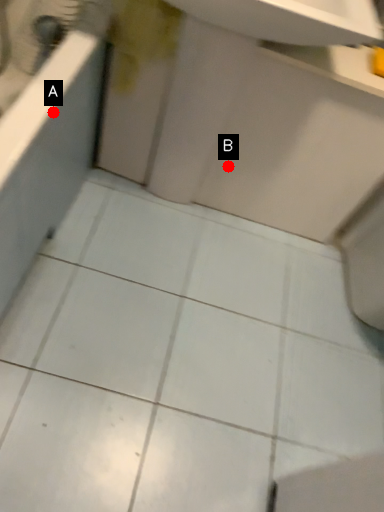
Question: Two points are circled on the image, labeled by A and B beside each circle. Which point is further to the camera?

Choices:
 (A) A is further
 (B) B is further

Answer: (B)